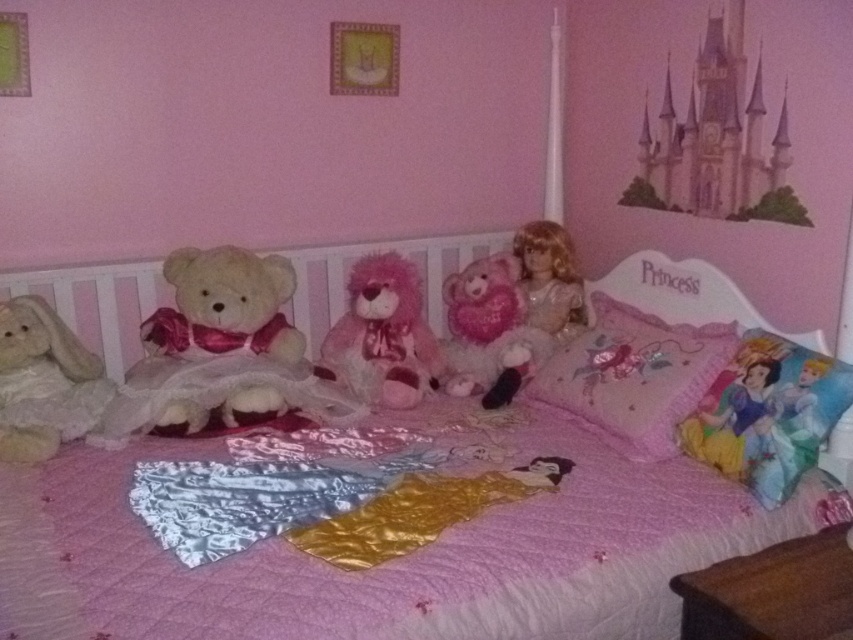
Is pink plush teddy bear at center above shiny blonde doll at center?

No, pink plush teddy bear at center is not above shiny blonde doll at center.

Is point (473, 260) closer to viewer compared to point (521, 266)?

No.

Find the location of a particular element. Image resolution: width=853 pixels, height=640 pixels. pink plush teddy bear at center is located at coordinates (490, 332).

Is point (645, 378) positioned in front of point (10, 380)?

No, it is behind (10, 380).

Between embroidered cotton pillow at center and fluffy beige teddy bear at left, which one is positioned higher?

embroidered cotton pillow at center is above.

Between point (556, 387) and point (19, 429), which one is positioned in front?

Point (19, 429) is in front.

The height and width of the screenshot is (640, 853). Identify the location of embroidered cotton pillow at center. (633, 376).

Does fluffy beige teddy bear at left appear on the right side of fluffy pink teddy bear at center?

In fact, fluffy beige teddy bear at left is to the left of fluffy pink teddy bear at center.

Based on the photo, does fluffy beige teddy bear at left appear under fluffy pink teddy bear at center?

Yes.

This screenshot has height=640, width=853. I want to click on fluffy beige teddy bear at left, so click(x=44, y=381).

At what (x,y) coordinates should I click in order to perform the action: click on fluffy beige teddy bear at left. Please return your answer as a coordinate pair (x, y). Looking at the image, I should click on (44, 381).